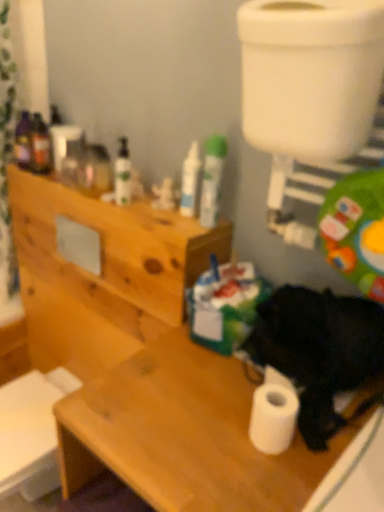
This screenshot has height=512, width=384. Identify the location of vacant point to the right of matte green bottle at upper center, which appears as the 1th toiletry when viewed from the left. (166, 210).